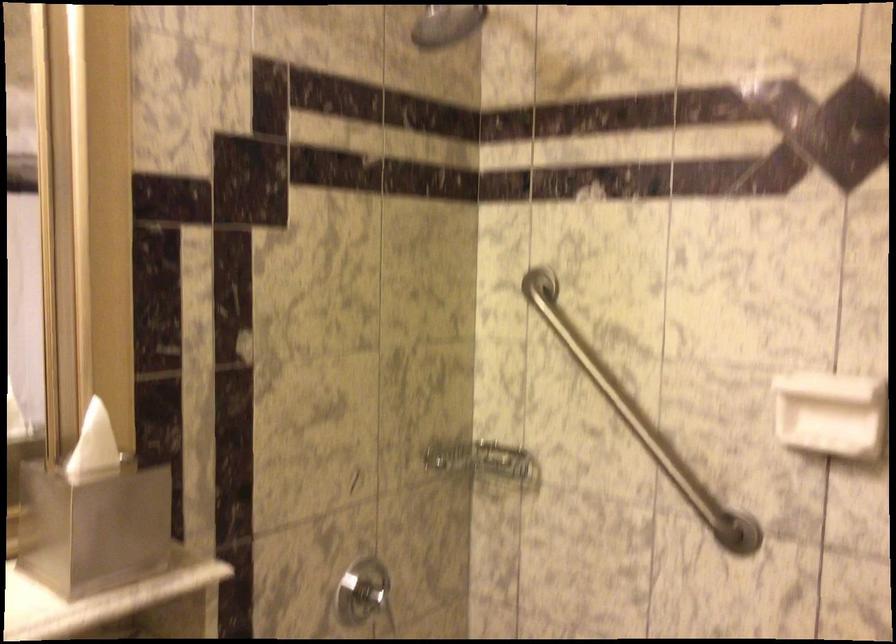
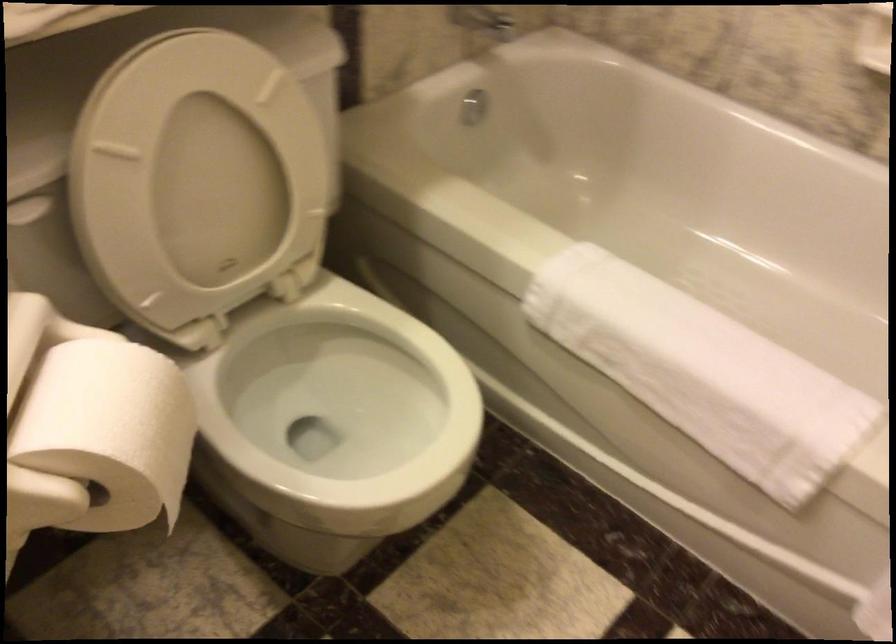
Question: The first image is from the beginning of the video and the second image is from the end. How did the camera likely rotate when shooting the video?

Choices:
 (A) Left
 (B) Right
 (C) Up
 (D) Down

Answer: (D)